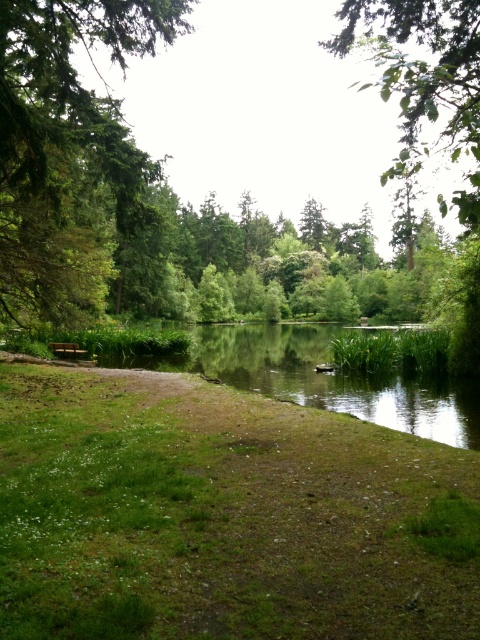
Question: Can you confirm if green leafy tree at upper right is thinner than wooden bench at lower left?

Choices:
 (A) no
 (B) yes

Answer: (A)

Question: Which object appears closest to the camera in this image?

Choices:
 (A) green leafy tree at upper right
 (B) green leafy tree at left

Answer: (A)

Question: Does green leafy tree at left have a lesser width compared to green leafy tree at upper right?

Choices:
 (A) yes
 (B) no

Answer: (A)

Question: Which object is the farthest from the green leafy tree at left?

Choices:
 (A) green leafy tree at upper right
 (B) wooden bench at lower left

Answer: (A)

Question: Which point is farther to the camera?

Choices:
 (A) wooden bench at lower left
 (B) green leafy tree at left

Answer: (A)

Question: Observing the image, what is the correct spatial positioning of green leafy tree at upper right in reference to wooden bench at lower left?

Choices:
 (A) right
 (B) left

Answer: (A)